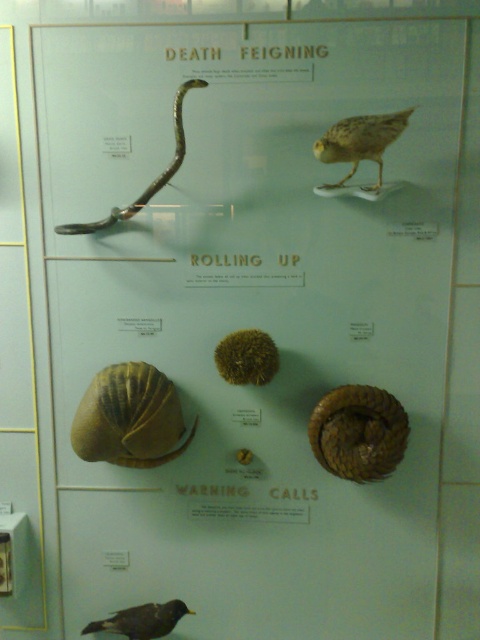
You are an art curator planning to install a new exhibit. You have a display case that can only accommodate items narrower than 30 cm. You see the brown scaly snail at center and the black feathered bird at lower left in the current display. Can both items fit in the display case if placed side by side?

The brown scaly snail at center is narrower than the black feathered bird at lower left. However, since the display case can only accommodate items narrower than 30 cm, we need to know the exact width of the wider item. If the black feathered bird at lower left is under 30 cm, then both could fit. If it exceeds 30 cm, neither would fit. The information provided does not specify the actual width measurements, so we cannot confirm.